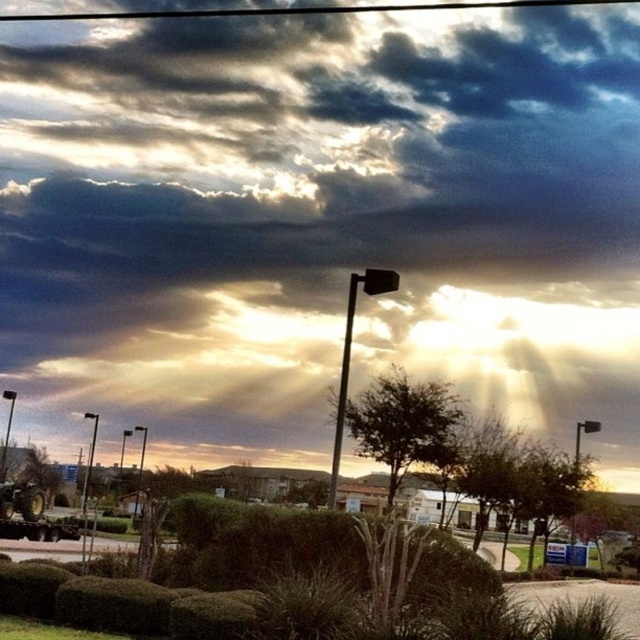
You are a city planner assessing the visibility of streetlights in this area. Given the two poles, the black metal pole at center and the metallic pole at upper left, which one is taller?

The black metal pole at center is taller than the metallic pole at upper left according to the description.

You are an observer looking at the cloudy sky at upper center and the metallic pole at upper left. Which object is closer to you?

The metallic pole at upper left is closer to you because the cloudy sky at upper center is further away, as stated in the description.